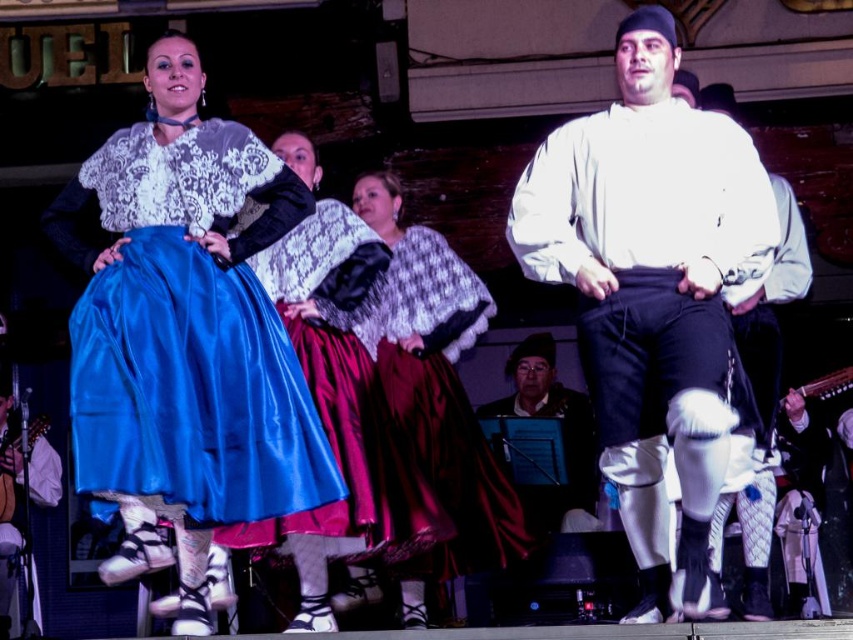
This screenshot has height=640, width=853. Describe the element at coordinates (439, 388) in the screenshot. I see `velvet maroon skirt at center` at that location.

Where is `velvet maroon skirt at center`? velvet maroon skirt at center is located at coordinates (439, 388).

Does shiny blue skirt at center have a smaller size compared to white cotton shirt at center?

Yes, shiny blue skirt at center is smaller than white cotton shirt at center.

Does shiny blue skirt at center have a greater width compared to white cotton shirt at center?

Yes.

Between point (190, 118) and point (788, 294), which one is positioned behind?

The point (788, 294) is behind.

Identify the location of shiny blue skirt at center. Image resolution: width=853 pixels, height=640 pixels. (187, 330).

Does white matte shirt at center have a greater height compared to white cotton shirt at center?

No.

Can you confirm if white matte shirt at center is positioned below white cotton shirt at center?

Yes.

Who is more forward, (630, 445) or (743, 557)?

Point (630, 445) is more forward.

Identify the location of white matte shirt at center. Image resolution: width=853 pixels, height=640 pixels. [653, 292].